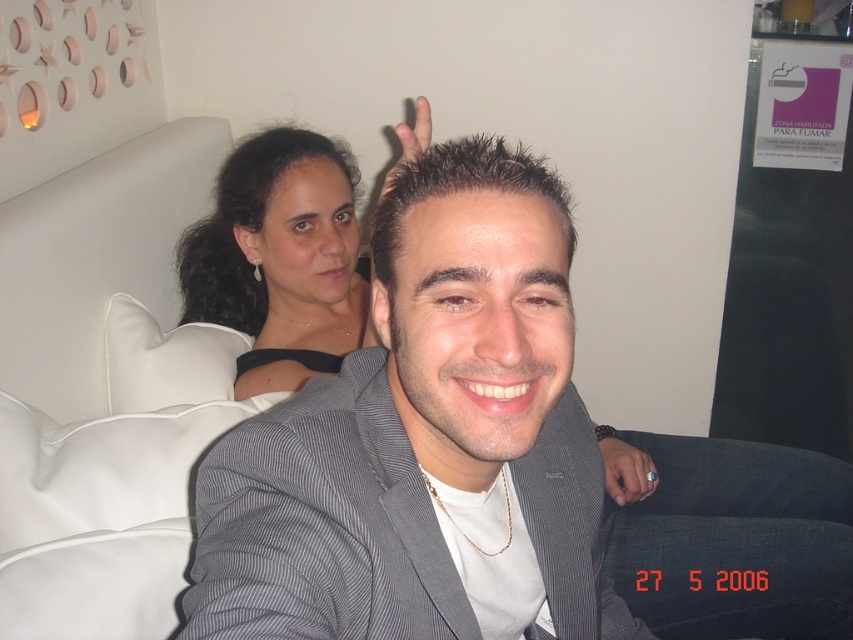
Question: Which of the following is the closest to the observer?

Choices:
 (A) matte black dress at upper left
 (B) matte black hand at upper center
 (C) gold ring at center
 (D) white fabric pillow at upper left

Answer: (B)

Question: Is matte black dress at upper left positioned before matte black hand at upper center?

Choices:
 (A) yes
 (B) no

Answer: (B)

Question: Does matte black dress at upper left have a larger size compared to gold ring at center?

Choices:
 (A) no
 (B) yes

Answer: (B)

Question: Among these objects, which one is farthest from the camera?

Choices:
 (A) white fabric pillow at upper left
 (B) gold ring at center
 (C) matte black hand at upper center

Answer: (B)

Question: Does white fabric pillow at upper left appear on the right side of matte black hand at upper center?

Choices:
 (A) no
 (B) yes

Answer: (A)

Question: Which point is farther from the camera taking this photo?

Choices:
 (A) (315, 310)
 (B) (149, 353)
 (C) (404, 152)

Answer: (A)